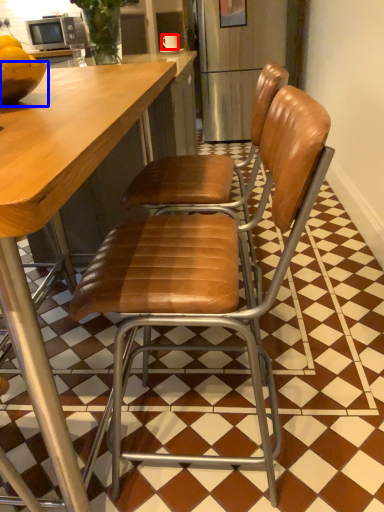
Question: Which of the following is the farthest to the observer, coffee cup (highlighted by a red box) or bowl (highlighted by a blue box)?

Choices:
 (A) coffee cup
 (B) bowl

Answer: (A)